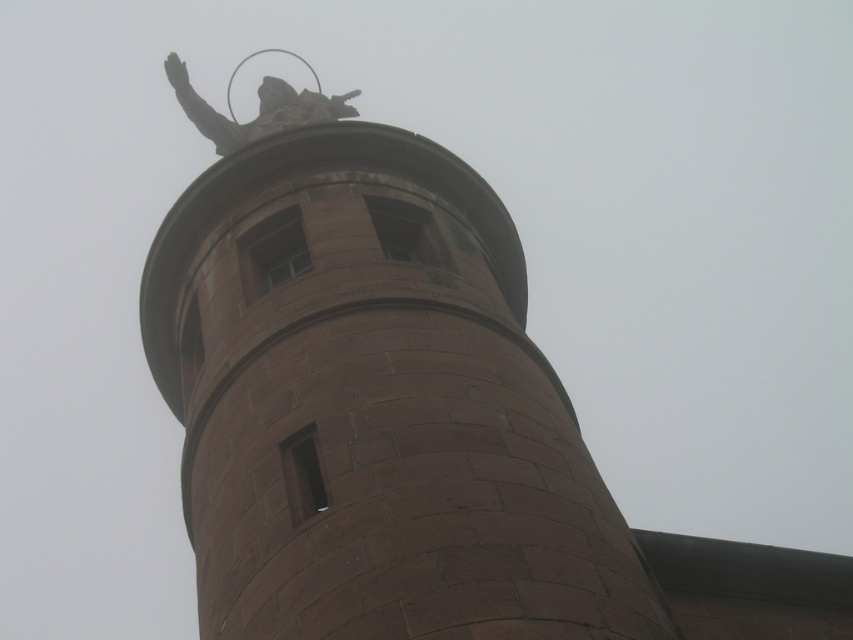
Is brown stone spire at upper center to the left of polished bronze statue at upper center from the viewer's perspective?

No, brown stone spire at upper center is not to the left of polished bronze statue at upper center.

Does brown stone spire at upper center have a greater height compared to polished bronze statue at upper center?

No, brown stone spire at upper center is not taller than polished bronze statue at upper center.

Is point (422, 278) less distant than point (210, 109)?

Yes, it is in front of point (210, 109).

Find the location of a particular element. This screenshot has height=640, width=853. brown stone spire at upper center is located at coordinates (370, 397).